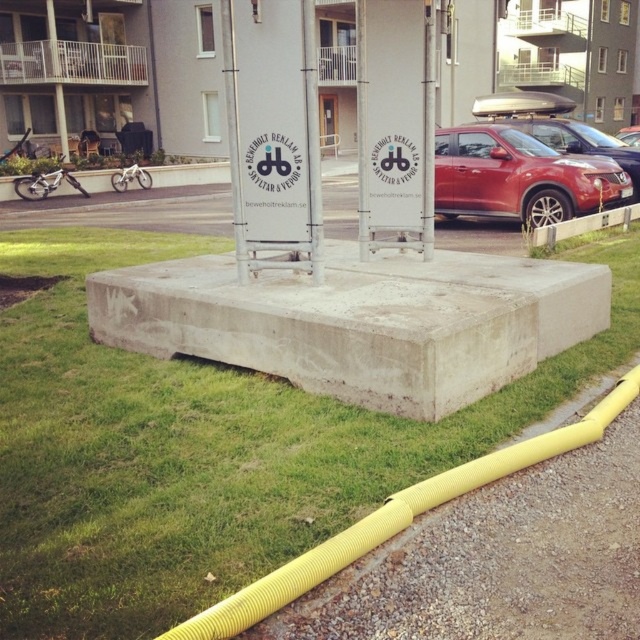
Who is more distant from viewer, (326, 282) or (584, 228)?

The point (584, 228) is more distant.

Measure the distance between point (x=408, y=326) and camera.

Point (x=408, y=326) is 14.55 feet away from camera.

Find the location of a particular element. Image resolution: width=640 pixels, height=640 pixels. gray concrete block at center is located at coordinates (360, 321).

Who is shorter, green grass at lower left or gray concrete block at center?

green grass at lower left is shorter.

Does green grass at lower left have a greater width compared to gray concrete block at center?

Incorrect, green grass at lower left's width does not surpass gray concrete block at center's.

Between point (413, 445) and point (285, 301), which one is positioned in front?

Point (413, 445)

At what (x,y) coordinates should I click in order to perform the action: click on green grass at lower left. Please return your answer as a coordinate pair (x, y). The image size is (640, 640). Looking at the image, I should click on (204, 449).

Does matte red car at right have a greater width compared to concrete curb at lower right?

Yes, matte red car at right is wider than concrete curb at lower right.

Which is more to the left, matte red car at right or concrete curb at lower right?

From the viewer's perspective, matte red car at right appears more on the left side.

Identify the location of matte red car at right. (520, 177).

This screenshot has width=640, height=640. What are the coordinates of `matte red car at right` in the screenshot? It's located at (520, 177).